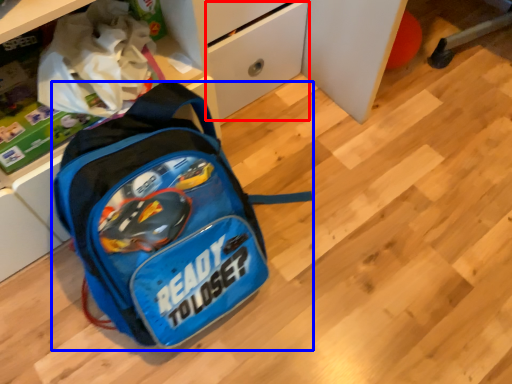
Question: Which object appears farthest to the camera in this image, drawer (highlighted by a red box) or backpack (highlighted by a blue box)?

Choices:
 (A) drawer
 (B) backpack

Answer: (A)